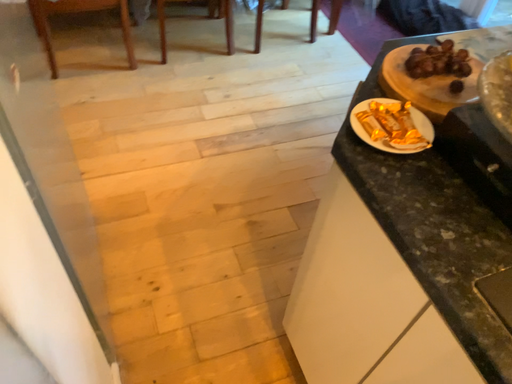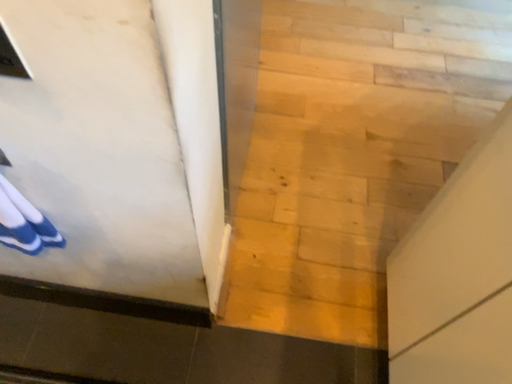
Question: How did the camera likely rotate when shooting the video?

Choices:
 (A) rotated left
 (B) rotated right

Answer: (A)